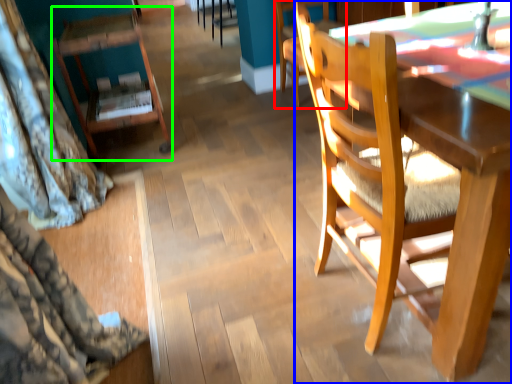
Question: Which object is positioned farthest from chair (highlighted by a red box)? Select from chair (highlighted by a blue box) and chair (highlighted by a green box).

Choices:
 (A) chair
 (B) chair

Answer: (A)